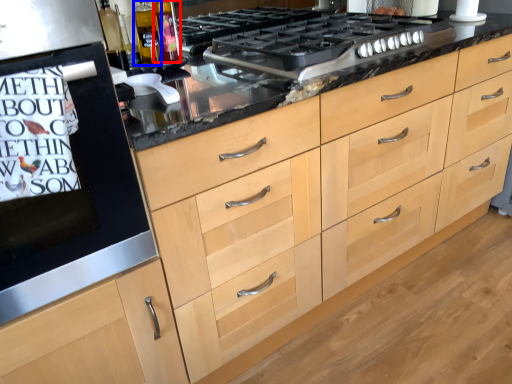
Question: Which point is closer to the camera, bottle (highlighted by a red box) or bottle (highlighted by a blue box)?

Choices:
 (A) bottle
 (B) bottle

Answer: (B)